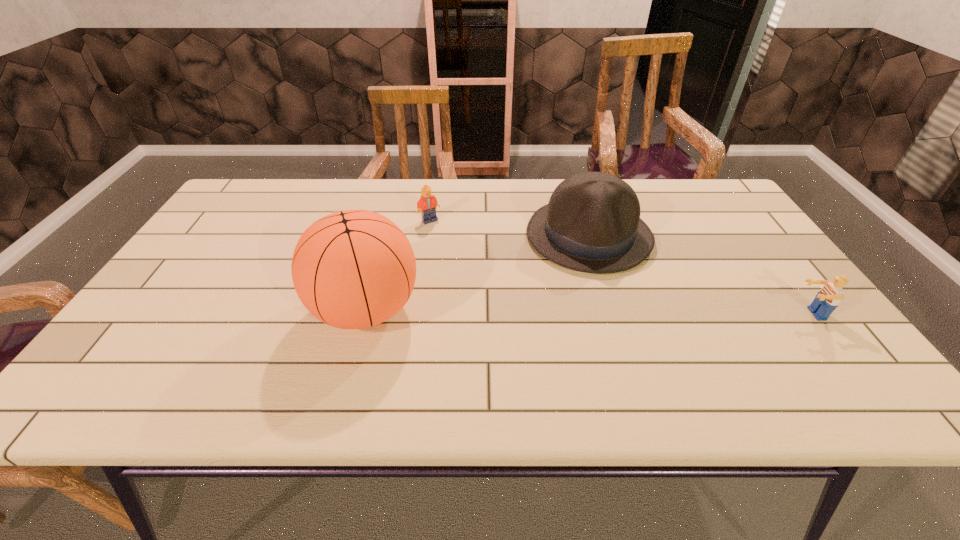
The width and height of the screenshot is (960, 540). Find the location of `vacant space at the far right corner`. vacant space at the far right corner is located at coordinates (732, 212).

Where is `vacant space at the near right corner of the desktop`? This screenshot has height=540, width=960. vacant space at the near right corner of the desktop is located at coordinates (773, 339).

Find the location of a particular element. free space between the fourth object from left to right and the right Lego is located at coordinates (699, 275).

You are a GUI agent. You are given a task and a screenshot of the screen. Output one action in this format:
    pyautogui.click(x=<x>, y=<y>)
    Task: Click on the blank region between the rightmost object and the bowler hat
    Image resolution: width=960 pixels, height=540 pixels.
    Given the screenshot: What is the action you would take?
    pyautogui.click(x=699, y=275)

Locate an element on the screen. This screenshot has height=540, width=960. free area in between the second tallest object and the tallest object is located at coordinates (477, 273).

This screenshot has width=960, height=540. Find the location of `free space between the nearer Lego and the bowler hat`. free space between the nearer Lego and the bowler hat is located at coordinates (699, 275).

You are a GUI agent. You are given a task and a screenshot of the screen. Output one action in this format:
    pyautogui.click(x=<x>, y=<y>)
    Task: Click on the vacant space that is in between the nearer Lego and the tallest object
    The image size is (960, 540).
    Given the screenshot: What is the action you would take?
    pyautogui.click(x=588, y=312)

This screenshot has height=540, width=960. Identify the location of vacant area that lies between the nearer Lego and the fourth shortest object. (699, 275).

Find the location of a particular element. The width and height of the screenshot is (960, 540). free space that is in between the fourth shortest object and the left Lego is located at coordinates (509, 228).

At what (x,y) coordinates should I click in order to perform the action: click on empty space that is in between the nearer Lego and the bowler hat. Please return your answer as a coordinate pair (x, y). This screenshot has height=540, width=960. Looking at the image, I should click on (699, 275).